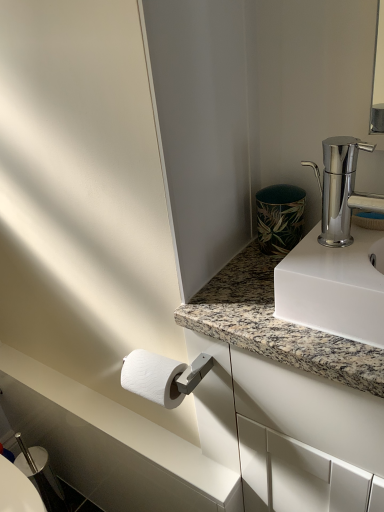
Where is `free space in front of green leaf-patterned ceramic at upper right`? free space in front of green leaf-patterned ceramic at upper right is located at coordinates (254, 294).